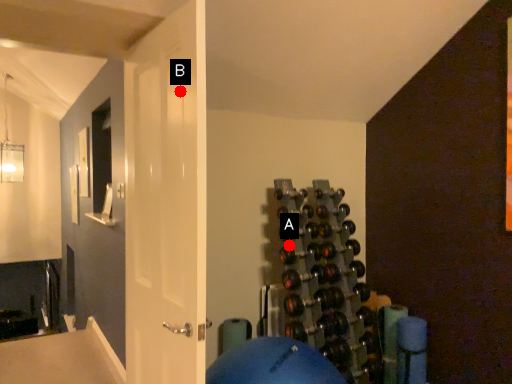
Question: Two points are circled on the image, labeled by A and B beside each circle. Which of the following is the closest to the observer?

Choices:
 (A) A is closer
 (B) B is closer

Answer: (B)